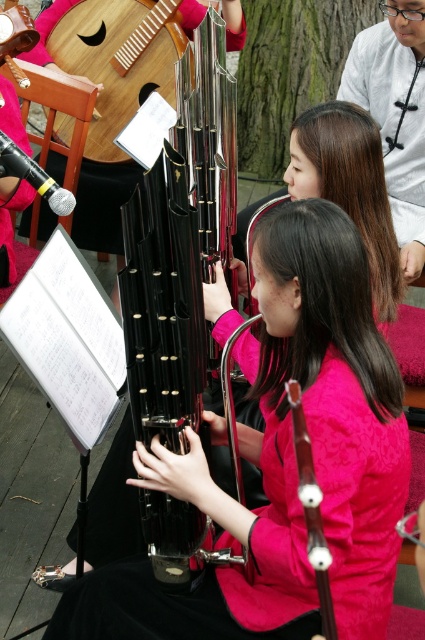
Question: Is wooden acoustic guitar at upper left positioned before matte pink sweater at center?

Choices:
 (A) no
 (B) yes

Answer: (A)

Question: Which is farther from the wooden string instrument at center?

Choices:
 (A) black glossy bassoon at center
 (B) matte pink sweater at center
 (C) wooden acoustic guitar at upper left

Answer: (C)

Question: Can you confirm if black glossy bassoon at center is smaller than wooden acoustic guitar at upper left?

Choices:
 (A) yes
 (B) no

Answer: (B)

Question: Which point is closer to the camera?

Choices:
 (A) black glossy bassoon at center
 (B) wooden string instrument at center
 (C) matte pink sweater at center

Answer: (B)

Question: Does wooden acoustic guitar at upper left appear on the right side of wooden string instrument at center?

Choices:
 (A) yes
 (B) no

Answer: (B)

Question: Which of these objects is positioned farthest from the wooden string instrument at center?

Choices:
 (A) black glossy bassoon at center
 (B) wooden acoustic guitar at upper left

Answer: (B)